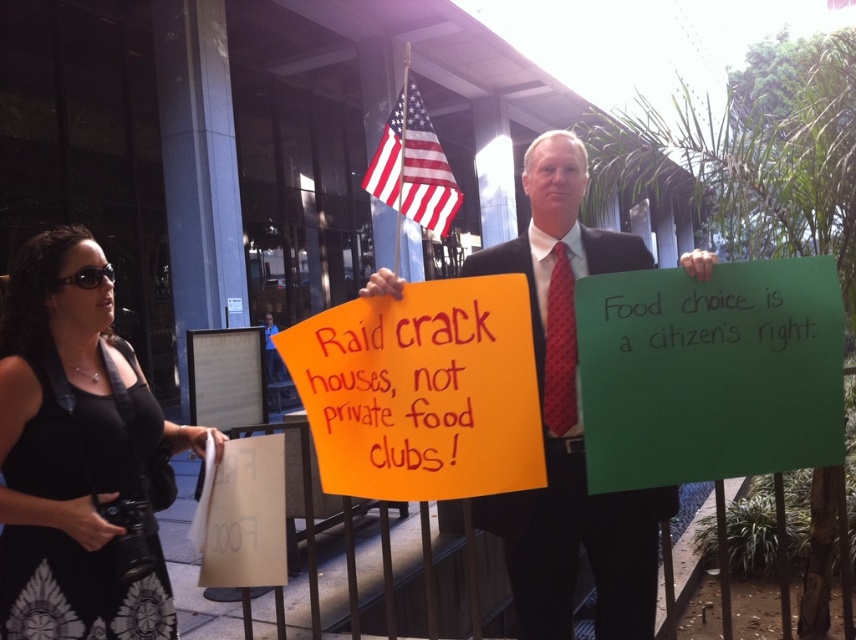
You are a photographer standing at the center of the protest scene. You want to take a photo of the black dress at left without moving your position. Can you capture it in your current field of view?

The black dress at left is 1.52 meters from the camera, so yes, it can be captured in the current field of view as it is within the camera range.

What are the coordinates of the green paper sign at center?

The green paper sign at center is located at point (710, 372).